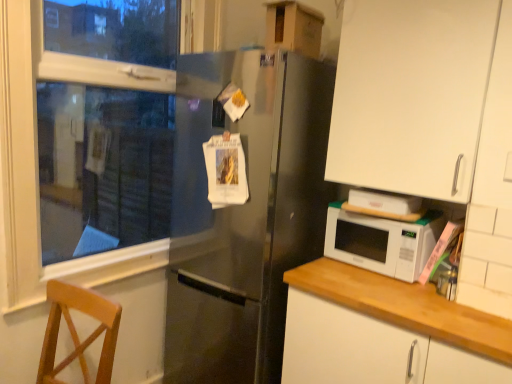
Question: Is wooden chair at lower left turned away from satin black refrigerator at center?

Choices:
 (A) yes
 (B) no

Answer: (A)

Question: Is wooden chair at lower left further to camera compared to satin black refrigerator at center?

Choices:
 (A) yes
 (B) no

Answer: (B)

Question: From a real-world perspective, is wooden chair at lower left positioned under satin black refrigerator at center based on gravity?

Choices:
 (A) no
 (B) yes

Answer: (B)

Question: From a real-world perspective, is wooden chair at lower left on satin black refrigerator at center?

Choices:
 (A) yes
 (B) no

Answer: (B)

Question: Can you confirm if wooden chair at lower left is thinner than satin black refrigerator at center?

Choices:
 (A) yes
 (B) no

Answer: (A)

Question: From the image's perspective, is wooden chair at lower left located above satin black refrigerator at center?

Choices:
 (A) no
 (B) yes

Answer: (A)

Question: Does wooden chair at lower left lie behind white plastic window frame at left?

Choices:
 (A) yes
 (B) no

Answer: (B)

Question: From a real-world perspective, is wooden chair at lower left located beneath white plastic window frame at left?

Choices:
 (A) no
 (B) yes

Answer: (B)

Question: Considering the relative sizes of wooden chair at lower left and white plastic window frame at left in the image provided, is wooden chair at lower left smaller than white plastic window frame at left?

Choices:
 (A) no
 (B) yes

Answer: (B)

Question: Does wooden chair at lower left have a lesser width compared to white plastic window frame at left?

Choices:
 (A) yes
 (B) no

Answer: (B)

Question: Can white plastic window frame at left be found inside wooden chair at lower left?

Choices:
 (A) no
 (B) yes

Answer: (A)

Question: Is wooden chair at lower left taller than white plastic window frame at left?

Choices:
 (A) yes
 (B) no

Answer: (B)

Question: Is the surface of white plastic window frame at left in direct contact with white matte cabinet at right, the 2th cabinetry in the top-to-bottom sequence?

Choices:
 (A) yes
 (B) no

Answer: (B)